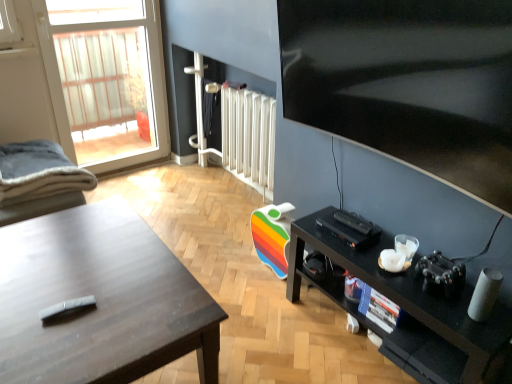
Question: Based on their sizes in the image, would you say transparent glass door at upper left is bigger or smaller than matte black desk at left?

Choices:
 (A) small
 (B) big

Answer: (A)

Question: Do you think transparent glass door at upper left is within matte black desk at left, or outside of it?

Choices:
 (A) inside
 (B) outside

Answer: (B)

Question: Which of these objects is positioned closest to the white glossy radiator at center?

Choices:
 (A) metallic silver screen door at upper center
 (B) black glossy tv at upper right
 (C) matte black desk at left
 (D) black matte shelf at lower right
 (E) transparent glass door at upper left

Answer: (A)

Question: Which object is the closest to the transparent glass door at upper left?

Choices:
 (A) metallic silver screen door at upper center
 (B) soft gray fabric chair at left
 (C) matte black desk at left
 (D) black matte shelf at lower right
 (E) black glossy tv at upper right

Answer: (A)